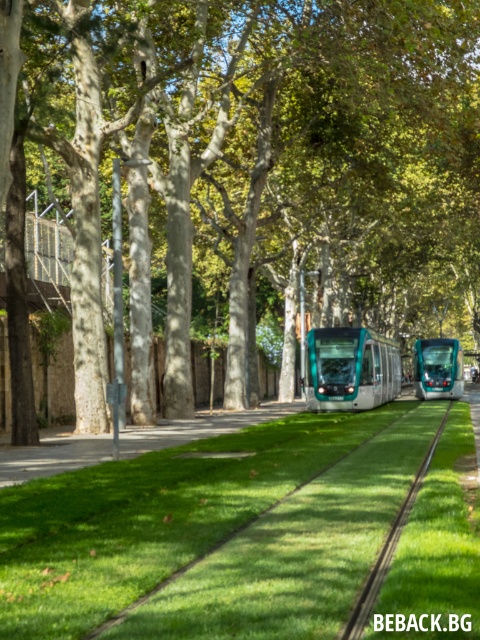
You are standing at the point with coordinates point [142,376] and want to walk to the point with coordinates point [416,486]. Which direction should you move to reach your destination?

You should move forward because point [142,376] is behind point [416,486], so moving forward from point [142,376] will lead you towards point [416,486].

You are a park visitor standing at the edge of the grassy area. You see the green leafy tree at center and the teal glossy tram at center. Which object is bigger in size?

The green leafy tree at center is larger in size than the teal glossy tram at center.